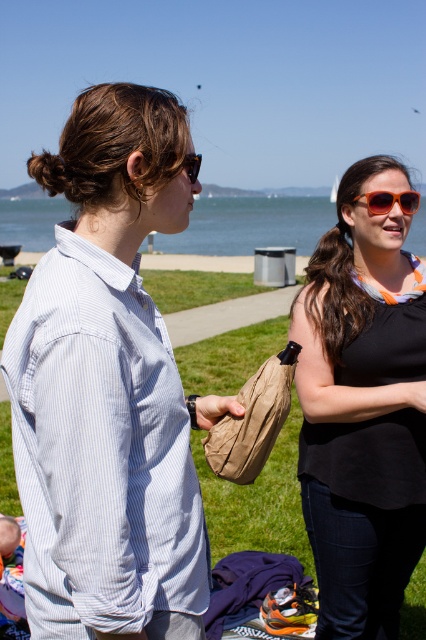
Question: Which point is closer to the camera taking this photo?

Choices:
 (A) (227, 275)
 (B) (316, 448)
 (C) (147, 458)

Answer: (C)

Question: Which object is positioned farthest from the matte black tank top at center?

Choices:
 (A) orange plastic sunglasses at center
 (B) green grass at center
 (C) light blue striped shirt at left

Answer: (B)

Question: Does light blue striped shirt at left come in front of matte black tank top at center?

Choices:
 (A) yes
 (B) no

Answer: (A)

Question: Among these objects, which one is farthest from the camera?

Choices:
 (A) green grass at center
 (B) orange plastic sunglasses at center

Answer: (A)

Question: Can you confirm if matte black tank top at center is bigger than clear blue water at upper center?

Choices:
 (A) yes
 (B) no

Answer: (B)

Question: Can you confirm if matte black tank top at center is bigger than clear blue water at upper center?

Choices:
 (A) no
 (B) yes

Answer: (A)